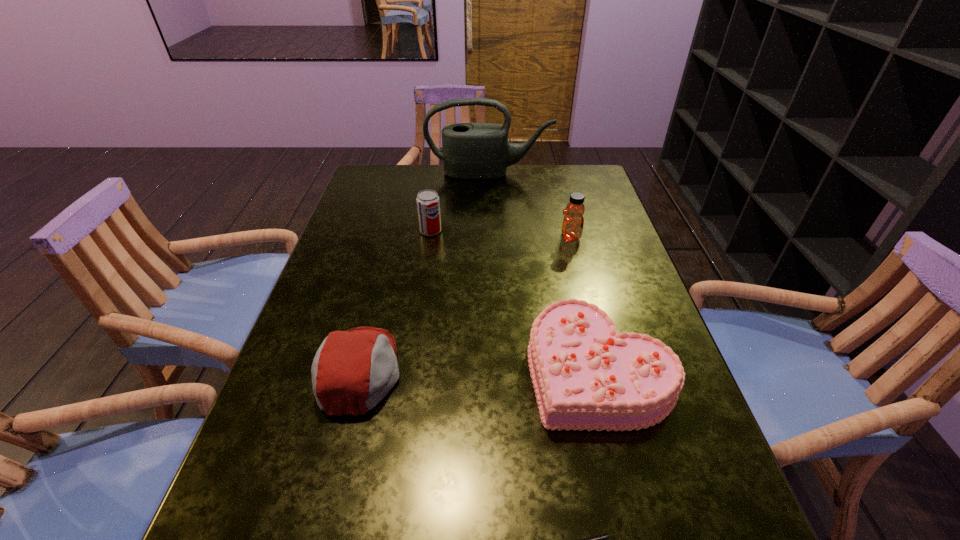
Image resolution: width=960 pixels, height=540 pixels. Identify the location of the tallest object. (470, 150).

Find the location of `the farthest object`. the farthest object is located at coordinates (470, 150).

The height and width of the screenshot is (540, 960). Identify the location of honey. (573, 222).

Locate an element on the screen. This screenshot has height=540, width=960. soda is located at coordinates (428, 205).

Identify the location of cap. The width and height of the screenshot is (960, 540). (353, 370).

Where is `cake`? The height and width of the screenshot is (540, 960). cake is located at coordinates (585, 375).

This screenshot has height=540, width=960. I want to click on blank space located on the spout of the farthest object, so click(491, 241).

Identify the location of free space located 0.140m on the front label of the honey. This screenshot has width=960, height=540. (508, 238).

Identify the location of free space located 0.150m on the front label of the honey. (504, 238).

Find the location of a particular element. vacant region located 0.270m on the front label of the honey is located at coordinates (460, 238).